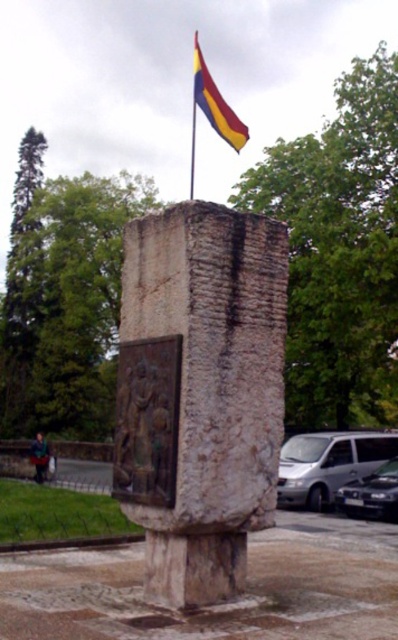
Who is positioned more to the left, yellow and red striped flag at upper center or metallic flag pole at upper center?

metallic flag pole at upper center is more to the left.

Is point (195, 86) farther from camera compared to point (193, 150)?

No.

Which is behind, point (193, 96) or point (191, 168)?

The point (193, 96) is behind.

This screenshot has width=398, height=640. In order to click on yellow and red striped flag at upper center in this screenshot , I will do `click(216, 104)`.

Measure the distance between white stone monument at center and yellow and red striped flag at upper center.

white stone monument at center and yellow and red striped flag at upper center are 63.69 feet apart.

Who is more distant from viewer, (191, 548) or (197, 54)?

Positioned behind is point (197, 54).

Locate an element on the screen. The width and height of the screenshot is (398, 640). white stone monument at center is located at coordinates (200, 394).

Is white stone monument at center wider than metallic flag pole at upper center?

In fact, white stone monument at center might be narrower than metallic flag pole at upper center.

Is white stone monument at center below metallic flag pole at upper center?

Correct, white stone monument at center is located below metallic flag pole at upper center.

The image size is (398, 640). What do you see at coordinates (200, 394) in the screenshot?
I see `white stone monument at center` at bounding box center [200, 394].

Where is `white stone monument at center`? This screenshot has width=398, height=640. white stone monument at center is located at coordinates (200, 394).